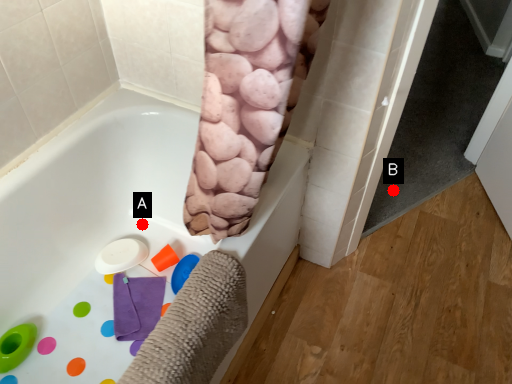
Question: Two points are circled on the image, labeled by A and B beside each circle. Which of the following is the closest to the observer?

Choices:
 (A) A is closer
 (B) B is closer

Answer: (A)